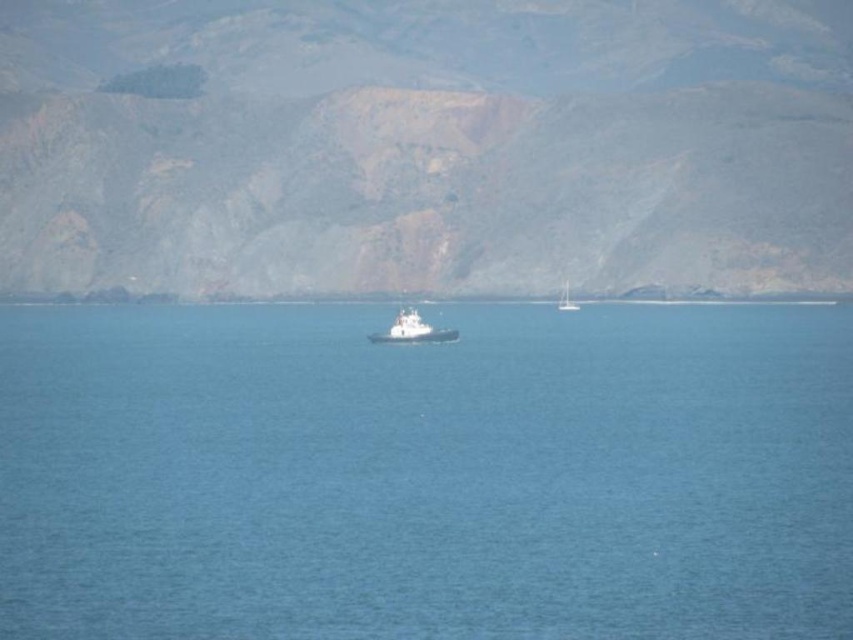
You are standing at the point with coordinates (424, 145) in the coastal scene. What object is located exactly at this point?

The brown rocky mountain at center is located exactly at point (424, 145).

You are a photographer planning to take a picture of the coastal scene. You want to ensure that the white matte boat at center is centered in your shot. Given that the boat is represented by the point coordinates point (412,330), is the boat already centered in the image?

The white matte boat at center is already centered in the image as it is represented by the point coordinates point (412,330), which corresponds to the center of the image.

You are a sailor navigating a small boat in the coastal scene. You need to pass between the blue water at center and the brown rocky mountain at center. Which direction should you steer your boat to avoid the mountain?

A: You should steer your boat to the left of the brown rocky mountain at center because the blue water at center is located to the right of the mountain, so moving left would keep you in the water and away from the cliffs.